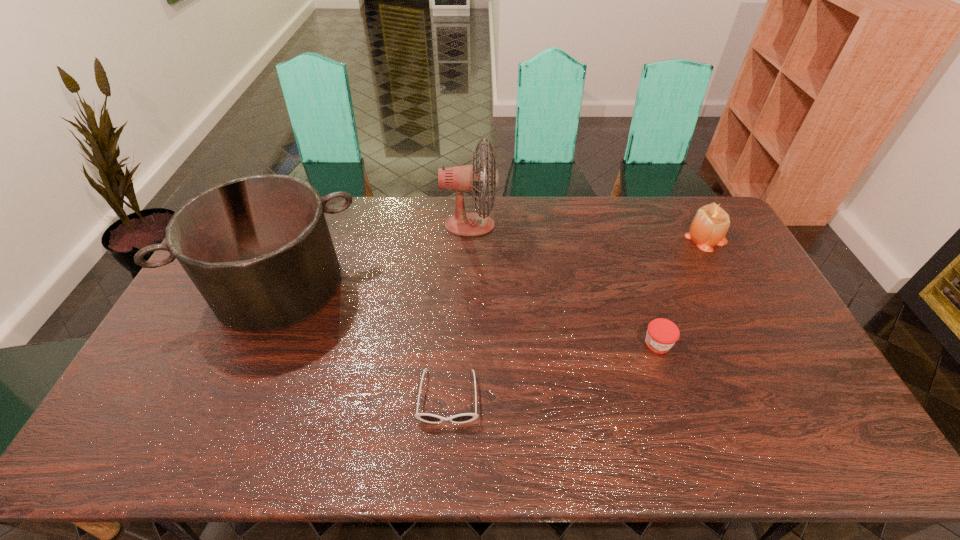
Where is `vacant space located on the front of the pan`? This screenshot has height=540, width=960. vacant space located on the front of the pan is located at coordinates (247, 360).

The width and height of the screenshot is (960, 540). In order to click on vacant space located 0.280m on the left of the third tallest object in this screenshot , I will do `click(607, 237)`.

This screenshot has width=960, height=540. Find the location of `free space located on the label side of the fourth tallest object`. free space located on the label side of the fourth tallest object is located at coordinates (676, 399).

At what (x,y) coordinates should I click in order to perform the action: click on vacant point located 0.050m with the lenses of the nearest object facing outward. Please return your answer as a coordinate pair (x, y). Looking at the image, I should click on [x=445, y=446].

At what (x,y) coordinates should I click in order to perform the action: click on fan that is at the far edge. Please return your answer as a coordinate pair (x, y). The height and width of the screenshot is (540, 960). Looking at the image, I should click on (465, 178).

At what (x,y) coordinates should I click in order to perform the action: click on candle present at the far edge. Please return your answer as a coordinate pair (x, y). The image size is (960, 540). Looking at the image, I should click on (711, 222).

Locate an element on the screen. object positioned at the near edge is located at coordinates (425, 417).

Locate an element on the screen. object that is at the left edge is located at coordinates (258, 248).

Locate an element on the screen. This screenshot has height=540, width=960. object that is at the right edge is located at coordinates point(711,222).

The height and width of the screenshot is (540, 960). What are the coordinates of `object present at the far right corner` in the screenshot? It's located at (711, 222).